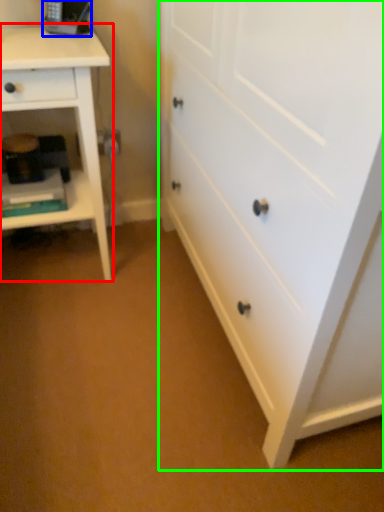
Question: Considering the real-world distances, which object is closest to nightstand (highlighted by a red box)? equipment (highlighted by a blue box) or chest of drawers (highlighted by a green box).

Choices:
 (A) equipment
 (B) chest of drawers

Answer: (A)